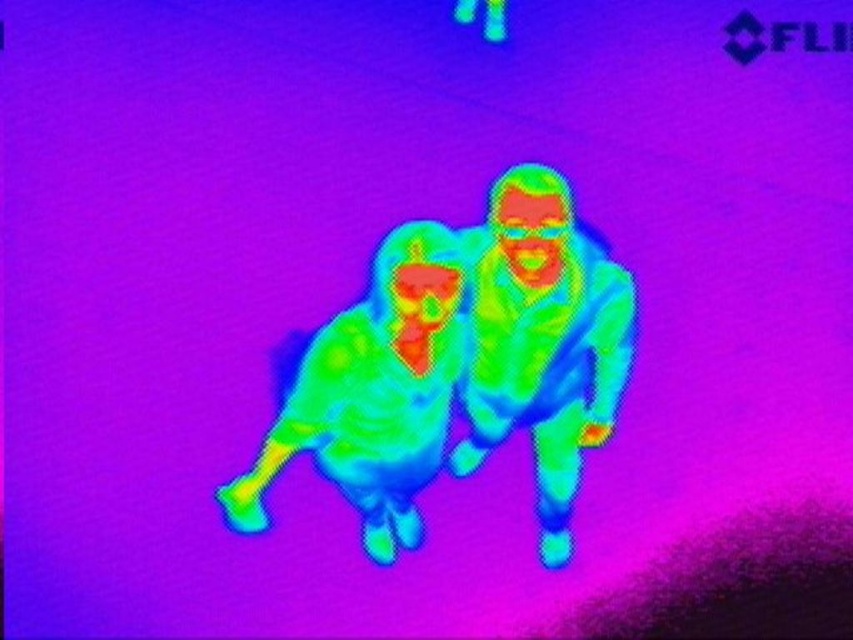
Which is behind, point (518, 278) or point (350, 374)?

Point (518, 278)

Between green matte figure at center and greenish-yellow fabric at center, which one appears on the right side from the viewer's perspective?

green matte figure at center is more to the right.

Who is more distant from viewer, (622, 333) or (361, 362)?

The point (622, 333) is more distant.

Where is `green matte figure at center`? The width and height of the screenshot is (853, 640). green matte figure at center is located at coordinates (543, 340).